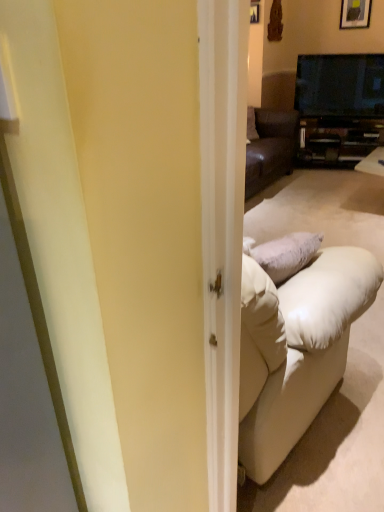
Describe the element at coordinates (355, 14) in the screenshot. This screenshot has height=512, width=384. I see `wooden framed picture at upper right` at that location.

The image size is (384, 512). What do you see at coordinates (340, 86) in the screenshot? I see `black glossy tv at upper right` at bounding box center [340, 86].

Describe the element at coordinates (338, 140) in the screenshot. This screenshot has width=384, height=512. I see `matte black cabinet at center` at that location.

Find the location of a particular element. wooden framed picture at upper right is located at coordinates (355, 14).

What's the angular difference between wooden framed picture at upper right and black glossy tv at upper right's facing directions?

The facing directions of wooden framed picture at upper right and black glossy tv at upper right are 22.2 degrees apart.

Does wooden framed picture at upper right appear on the right side of black glossy tv at upper right?

Correct, you'll find wooden framed picture at upper right to the right of black glossy tv at upper right.

Which of these two, wooden framed picture at upper right or black glossy tv at upper right, stands shorter?

Standing shorter between the two is wooden framed picture at upper right.

From a real-world perspective, is wooden framed picture at upper right positioned above or below black glossy tv at upper right?

In terms of real-world spatial position, wooden framed picture at upper right is above black glossy tv at upper right.

Which of these two, matte black cabinet at center or black glossy tv at upper right, is smaller?

Smaller between the two is black glossy tv at upper right.

From the image's perspective, relative to black glossy tv at upper right, is matte black cabinet at center above or below?

Clearly, from the image's perspective, matte black cabinet at center is below black glossy tv at upper right.

Considering the positions of point (338, 137) and point (361, 54), is point (338, 137) closer or farther from the camera than point (361, 54)?

Point (338, 137) is closer to the camera than point (361, 54).

You are a GUI agent. You are given a task and a screenshot of the screen. Output one action in this format:
    pyautogui.click(x=<x>, y=<y>)
    Task: Click on the television that is on the left side of matte black cabinet at center
    The image size is (384, 512).
    Given the screenshot: What is the action you would take?
    pyautogui.click(x=340, y=86)

Choose the correct answer: Is black glossy tv at upper right inside matte black cabinet at center or outside it?

black glossy tv at upper right lies outside matte black cabinet at center.

Is black glossy tv at upper right positioned with its back to matte black cabinet at center?

That's not correct — black glossy tv at upper right is not looking away from matte black cabinet at center.

Considering the relative sizes of black glossy tv at upper right and matte black cabinet at center in the image provided, is black glossy tv at upper right thinner than matte black cabinet at center?

Correct, the width of black glossy tv at upper right is less than that of matte black cabinet at center.

The height and width of the screenshot is (512, 384). In the image, there is a matte black cabinet at center. Identify the location of picture frame above it (from the image's perspective). (355, 14).

Considering the relative sizes of matte black cabinet at center and wooden framed picture at upper right in the image provided, is matte black cabinet at center thinner than wooden framed picture at upper right?

No, matte black cabinet at center is not thinner than wooden framed picture at upper right.

Considering the positions of objects matte black cabinet at center and wooden framed picture at upper right in the image provided, who is more to the right, matte black cabinet at center or wooden framed picture at upper right?

From the viewer's perspective, wooden framed picture at upper right appears more on the right side.

Can you confirm if wooden framed picture at upper right is bigger than matte black cabinet at center?

No.

Is wooden framed picture at upper right turned away from matte black cabinet at center?

No.

From a real-world perspective, who is located lower, wooden framed picture at upper right or matte black cabinet at center?

matte black cabinet at center is physically lower.

From the image's perspective, which object appears higher, black glossy tv at upper right or wooden framed picture at upper right?

From the image's view, wooden framed picture at upper right is above.

Considering the relative sizes of black glossy tv at upper right and wooden framed picture at upper right in the image provided, is black glossy tv at upper right wider than wooden framed picture at upper right?

Correct, the width of black glossy tv at upper right exceeds that of wooden framed picture at upper right.

Considering the sizes of objects black glossy tv at upper right and wooden framed picture at upper right in the image provided, who is smaller, black glossy tv at upper right or wooden framed picture at upper right?

wooden framed picture at upper right.

Is black glossy tv at upper right directly adjacent to wooden framed picture at upper right?

No, black glossy tv at upper right is not touching wooden framed picture at upper right.

At what (x,y) coordinates should I click in order to perform the action: click on television in front of the wooden framed picture at upper right. Please return your answer as a coordinate pair (x, y). The height and width of the screenshot is (512, 384). Looking at the image, I should click on (340, 86).

Locate an element on the screen. The height and width of the screenshot is (512, 384). cabinetry behind the black glossy tv at upper right is located at coordinates click(x=338, y=140).

Considering their positions, is wooden framed picture at upper right positioned closer to matte black cabinet at center than black glossy tv at upper right?

Based on the image, black glossy tv at upper right appears to be nearer to matte black cabinet at center.

Estimate the real-world distances between objects in this image. Which object is further from wooden framed picture at upper right, black glossy tv at upper right or matte black cabinet at center?

matte black cabinet at center is positioned further to the anchor wooden framed picture at upper right.

Which object lies nearer to the anchor point black glossy tv at upper right, wooden framed picture at upper right or matte black cabinet at center?

wooden framed picture at upper right.

Looking at the image, which one is located further to black glossy tv at upper right, matte black cabinet at center or wooden framed picture at upper right?

The object further to black glossy tv at upper right is matte black cabinet at center.

From the image, which object appears to be farther from matte black cabinet at center, black glossy tv at upper right or wooden framed picture at upper right?

The object further to matte black cabinet at center is wooden framed picture at upper right.

When comparing their distances from wooden framed picture at upper right, does matte black cabinet at center or black glossy tv at upper right seem further?

The object further to wooden framed picture at upper right is matte black cabinet at center.

You are a GUI agent. You are given a task and a screenshot of the screen. Output one action in this format:
    pyautogui.click(x=<x>, y=<y>)
    Task: Click on the television between wooden framed picture at upper right and matte black cabinet at center vertically
    Image resolution: width=384 pixels, height=512 pixels.
    Given the screenshot: What is the action you would take?
    pyautogui.click(x=340, y=86)